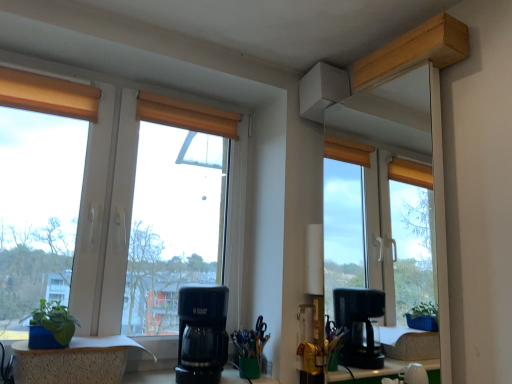
Question: Is green felt houseplant at lower left at the right side of black plastic coffee maker at center?

Choices:
 (A) no
 (B) yes

Answer: (A)

Question: Is the surface of green felt houseplant at lower left in direct contact with black plastic coffee maker at center?

Choices:
 (A) no
 (B) yes

Answer: (A)

Question: Is green felt houseplant at lower left wider than black plastic coffee maker at center?

Choices:
 (A) yes
 (B) no

Answer: (B)

Question: Considering the relative sizes of green felt houseplant at lower left and black plastic coffee maker at center in the image provided, is green felt houseplant at lower left taller than black plastic coffee maker at center?

Choices:
 (A) no
 (B) yes

Answer: (A)

Question: Is green felt houseplant at lower left thinner than black plastic coffee maker at center?

Choices:
 (A) no
 (B) yes

Answer: (B)

Question: Could you tell me if green felt houseplant at lower left is turned towards black plastic coffee maker at center?

Choices:
 (A) yes
 (B) no

Answer: (B)

Question: Is blue textured planter at lower left, the second window positioned from the top, at the right side of wooden blind at center?

Choices:
 (A) no
 (B) yes

Answer: (A)

Question: From a real-world perspective, is blue textured planter at lower left, the first window in the bottom-to-top sequence, over wooden blind at center?

Choices:
 (A) yes
 (B) no

Answer: (B)

Question: Would you say wooden blind at center is part of blue textured planter at lower left, the first window in the bottom-to-top sequence,'s contents?

Choices:
 (A) yes
 (B) no

Answer: (B)

Question: From a real-world perspective, is blue textured planter at lower left, the second window positioned from the top, physically below wooden blind at center?

Choices:
 (A) no
 (B) yes

Answer: (B)

Question: Is the position of blue textured planter at lower left, the first window in the bottom-to-top sequence, more distant than that of wooden blind at center?

Choices:
 (A) yes
 (B) no

Answer: (B)

Question: Is blue textured planter at lower left, the second window positioned from the top, directly adjacent to wooden blind at center?

Choices:
 (A) no
 (B) yes

Answer: (A)

Question: Does green felt houseplant at lower left have a larger size compared to blue textured planter at lower left, the second window positioned from the top?

Choices:
 (A) no
 (B) yes

Answer: (A)